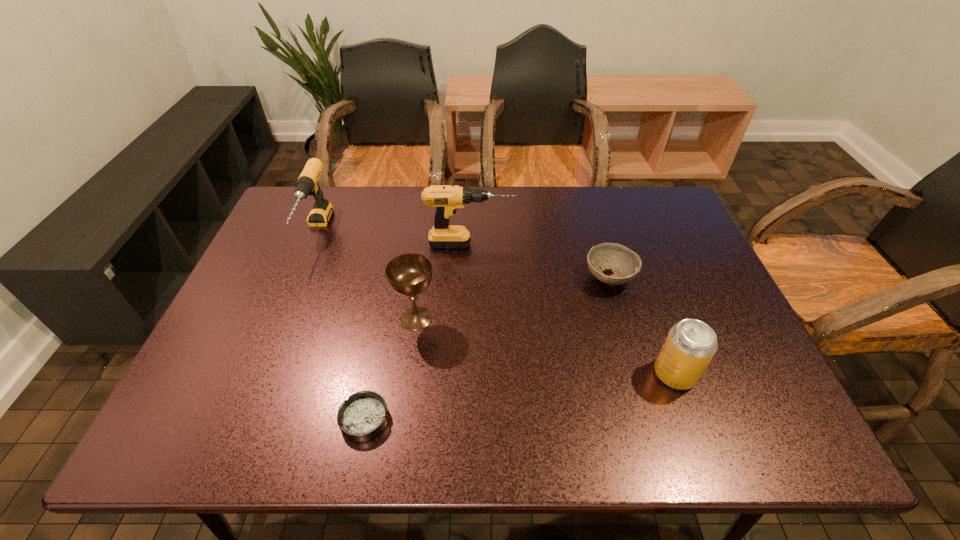
Find the location of `free spot between the third shortest object and the ashtray`. free spot between the third shortest object and the ashtray is located at coordinates (519, 396).

Locate an element on the screen. This screenshot has width=960, height=540. blank region between the third nearest object and the shorter drill is located at coordinates (367, 275).

Locate an element on the screen. This screenshot has width=960, height=540. free space between the shortest object and the leftmost object is located at coordinates (341, 325).

Where is `vacant region between the fourth tallest object and the right drill`? vacant region between the fourth tallest object and the right drill is located at coordinates (572, 309).

At what (x,y) coordinates should I click in order to perform the action: click on vacant space in between the ashtray and the left drill. Please return your answer as a coordinate pair (x, y). Image resolution: width=960 pixels, height=540 pixels. Looking at the image, I should click on (341, 325).

At what (x,y) coordinates should I click in order to perform the action: click on object that can be found as the fifth closest to the leftmost object. Please return your answer as a coordinate pair (x, y). The height and width of the screenshot is (540, 960). Looking at the image, I should click on (690, 345).

Identify which object is the second nearest to the pop (soda). Please provide its 2D coordinates. Your answer should be formatted as a tuple, i.e. [(x, y)], where the tuple contains the x and y coordinates of a point satisfying the conditions above.

[(447, 198)]

You are a GUI agent. You are given a task and a screenshot of the screen. Output one action in this format:
    pyautogui.click(x=<x>, y=<y>)
    Task: Click on the free region that satisfies the following two spatial constraints: 1. at the tip of the second nearest object; 2. on the right side of the right drill
    
    Given the screenshot: What is the action you would take?
    pyautogui.click(x=468, y=374)

I want to click on vacant space that satisfies the following two spatial constraints: 1. on the handle side of the shorter drill; 2. on the left side of the fourth farthest object, so click(280, 319).

Find the location of a particular element. Image resolution: width=960 pixels, height=540 pixels. vacant area in the image that satisfies the following two spatial constraints: 1. on the handle side of the nearest object; 2. on the right side of the shorter drill is located at coordinates (238, 419).